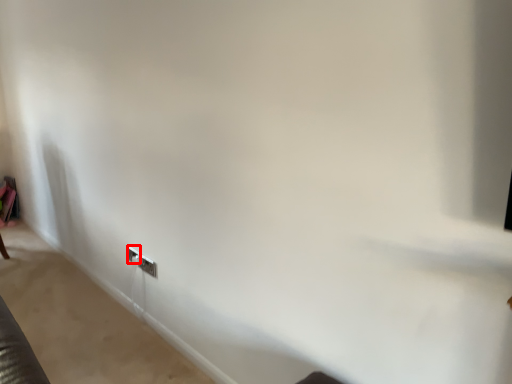
Question: From the image's perspective, where is electric outlet (annotated by the red box) located in relation to electric outlet in the image?

Choices:
 (A) above
 (B) below

Answer: (A)